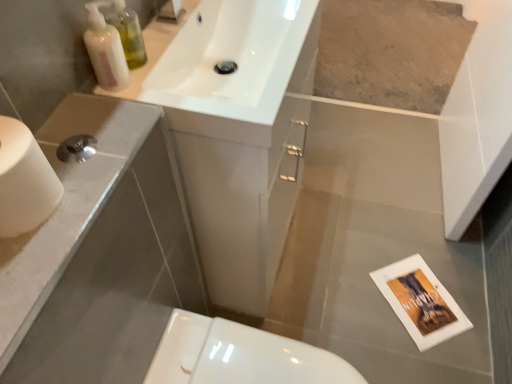
Where is `free point to the right of white matte toilet paper at left`? The height and width of the screenshot is (384, 512). free point to the right of white matte toilet paper at left is located at coordinates (87, 195).